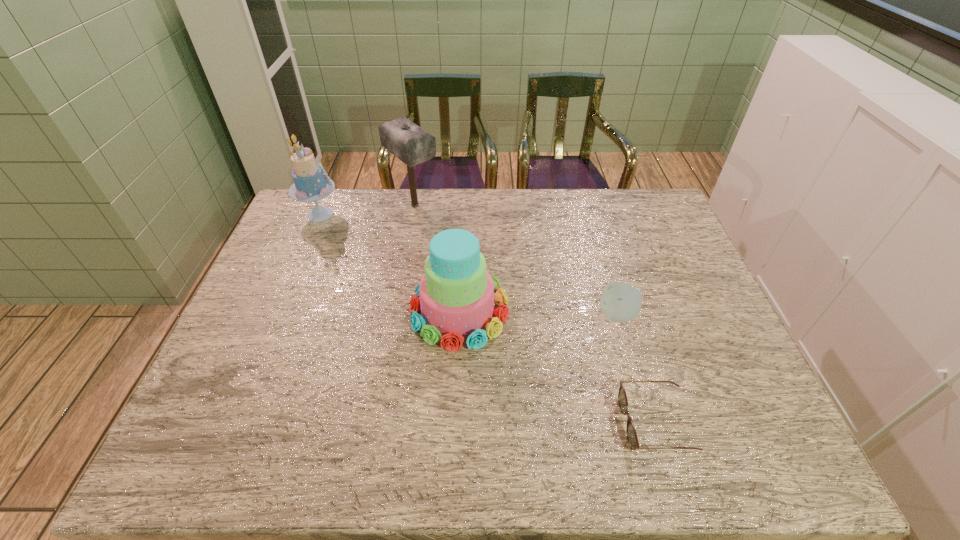
In order to click on blank space located on the back of the shorter cake in this screenshot , I will do `click(465, 197)`.

Find the location of a particular element. This screenshot has width=960, height=540. free space located on the back of the fourth tallest object is located at coordinates tap(605, 271).

Locate an element on the screen. free space located 0.290m at the front view of the shortest object is located at coordinates (493, 424).

Find the location of a particular element. vacant space located 0.150m at the front view of the shortest object is located at coordinates (556, 424).

Find the location of `free point located 0.330m at the front view of the shortest object`. free point located 0.330m at the front view of the shortest object is located at coordinates (475, 424).

This screenshot has width=960, height=540. Identify the location of mallet situated at the far edge. (411, 144).

Identify the location of cake that is at the far edge. (310, 184).

At what (x,y) coordinates should I click in order to perform the action: click on object at the near edge. Please return your answer as a coordinate pair (x, y). This screenshot has width=960, height=540. Looking at the image, I should click on (632, 438).

I want to click on object at the left edge, so pos(310,184).

Locate an element on the screen. This screenshot has height=540, width=960. object located at the far left corner is located at coordinates (310, 184).